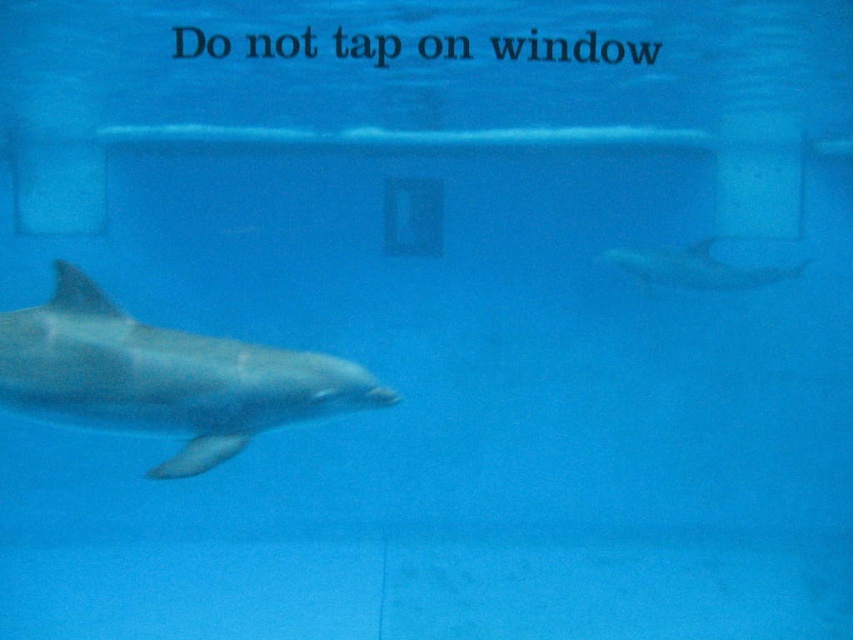
Question: Which point appears farthest from the camera in this image?

Choices:
 (A) (790, 273)
 (B) (379, 406)

Answer: (A)

Question: Does smooth gray dolphin at left have a larger size compared to smooth gray dolphin at upper right?

Choices:
 (A) no
 (B) yes

Answer: (B)

Question: Which point is closer to the camera taking this photo?

Choices:
 (A) (125, 412)
 (B) (787, 278)

Answer: (A)

Question: Observing the image, what is the correct spatial positioning of smooth gray dolphin at left in reference to smooth gray dolphin at upper right?

Choices:
 (A) above
 (B) below

Answer: (B)

Question: Can you confirm if smooth gray dolphin at left is smaller than smooth gray dolphin at upper right?

Choices:
 (A) no
 (B) yes

Answer: (A)